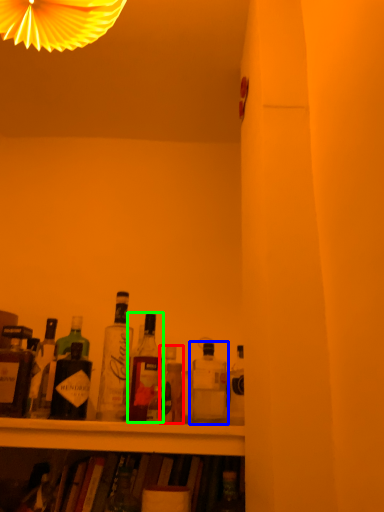
Question: Based on their relative distances, which object is farther from bottle (highlighted by a red box)? Choose from bottle (highlighted by a blue box) and bottle (highlighted by a green box).

Choices:
 (A) bottle
 (B) bottle

Answer: (A)